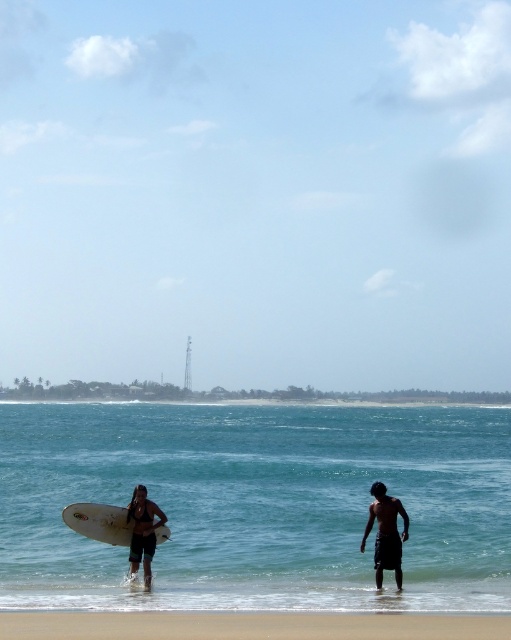
Question: Is dark brown skin at lower right above matte black surfboard at center?

Choices:
 (A) no
 (B) yes

Answer: (A)

Question: Considering the relative positions of clear blue water at center and matte black surfboard at center in the image provided, where is clear blue water at center located with respect to matte black surfboard at center?

Choices:
 (A) right
 (B) left

Answer: (A)

Question: Is clear blue water at center wider than dark brown skin at lower right?

Choices:
 (A) no
 (B) yes

Answer: (B)

Question: Considering the real-world distances, which object is closest to the dark brown skin at lower right?

Choices:
 (A) white matte surfboard at lower left
 (B) sandy beach at lower center
 (C) matte black surfboard at center
 (D) clear blue water at center

Answer: (C)

Question: Which point is closer to the camera taking this photo?

Choices:
 (A) (76, 509)
 (B) (164, 513)
 (C) (311, 460)

Answer: (B)

Question: Which object appears closest to the camera in this image?

Choices:
 (A) matte black surfboard at center
 (B) white matte surfboard at lower left
 (C) sandy beach at lower center
 (D) dark brown skin at lower right

Answer: (C)